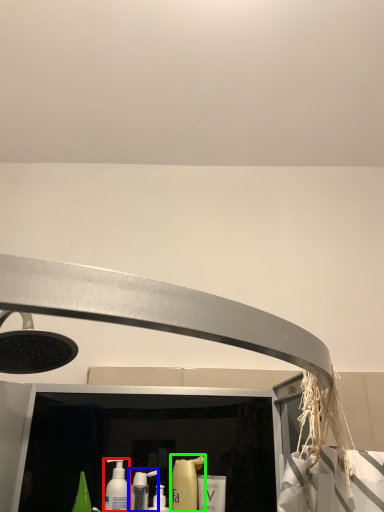
Question: Which object is the closest to the mouthwash (highlighted by a red box)? Choose among these: cleaning product (highlighted by a blue box) or cleaning product (highlighted by a green box).

Choices:
 (A) cleaning product
 (B) cleaning product

Answer: (A)